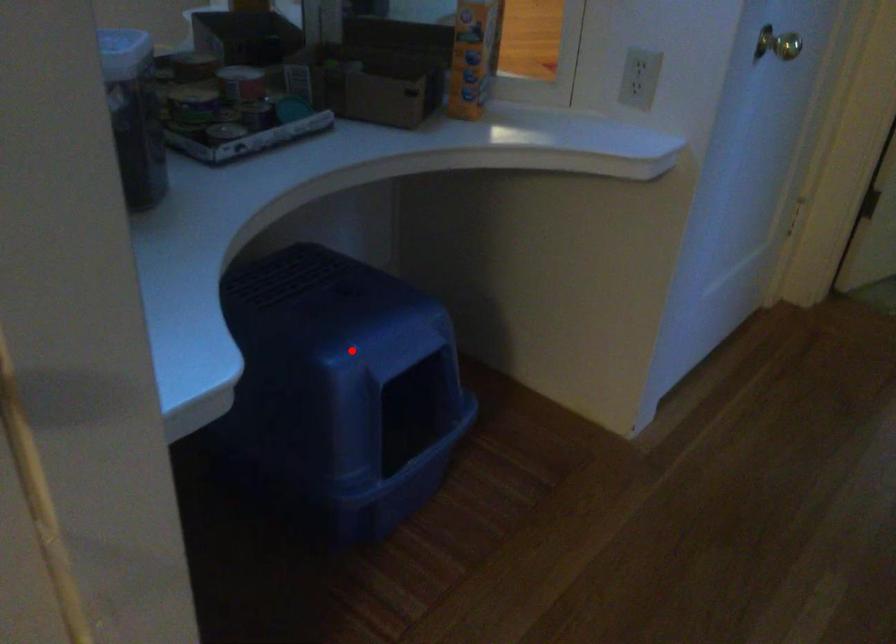
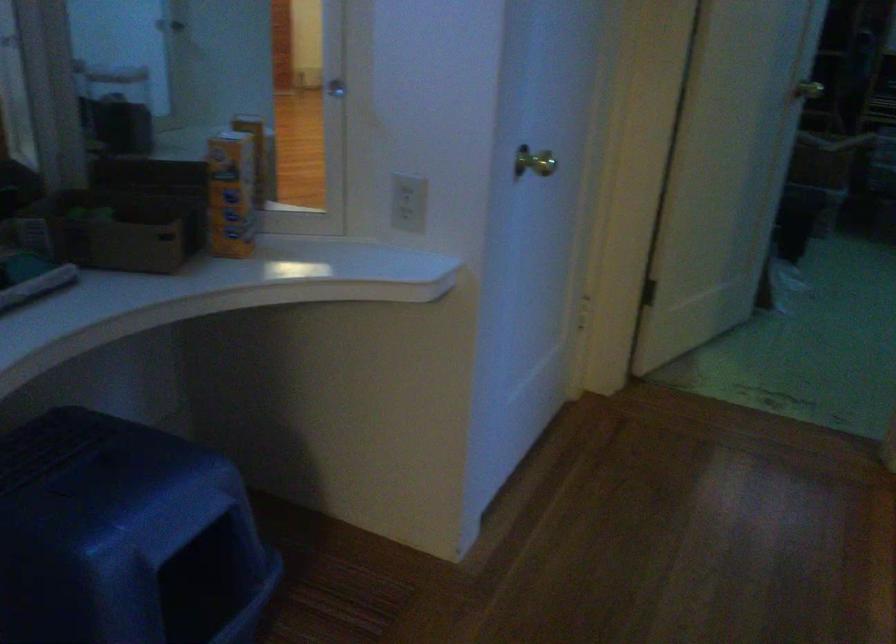
The point at the highlighted location is marked in the first image. Where is the corresponding point in the second image?

(124, 536)